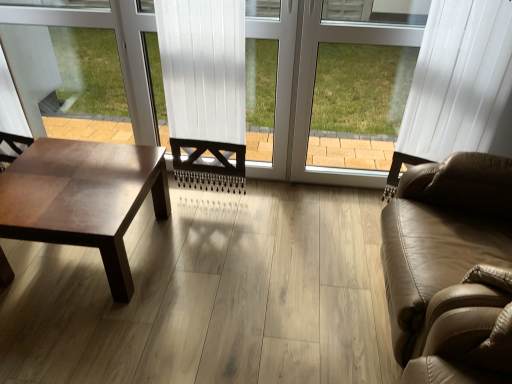
Locate an element on the screen. This screenshot has width=512, height=384. free spot below shiny brown wood coffee table at left (from a real-world perspective) is located at coordinates (81, 259).